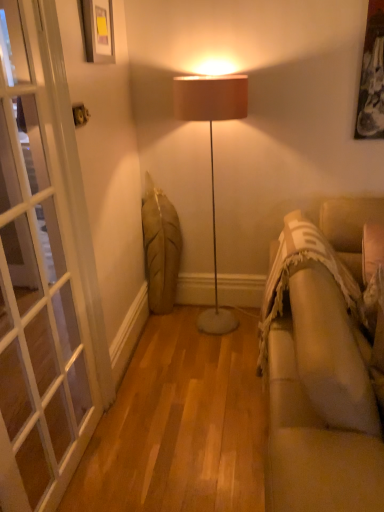
Question: Is white glass screen door at left further to camera compared to beige fabric couch at right?

Choices:
 (A) no
 (B) yes

Answer: (B)

Question: Is white glass screen door at left surrounding beige fabric couch at right?

Choices:
 (A) yes
 (B) no

Answer: (B)

Question: Is white glass screen door at left completely or partially outside of beige fabric couch at right?

Choices:
 (A) no
 (B) yes

Answer: (B)

Question: Can you confirm if white glass screen door at left is bigger than beige fabric couch at right?

Choices:
 (A) yes
 (B) no

Answer: (B)

Question: Is white glass screen door at left wider than beige fabric couch at right?

Choices:
 (A) no
 (B) yes

Answer: (A)

Question: From the image's perspective, is white glass screen door at left over beige fabric couch at right?

Choices:
 (A) yes
 (B) no

Answer: (A)

Question: Is matte black picture frame at upper left completely or partially outside of beige fabric couch at right?

Choices:
 (A) no
 (B) yes

Answer: (B)

Question: Is matte black picture frame at upper left wider than beige fabric couch at right?

Choices:
 (A) yes
 (B) no

Answer: (B)

Question: Does matte black picture frame at upper left contain beige fabric couch at right?

Choices:
 (A) no
 (B) yes

Answer: (A)

Question: Is matte black picture frame at upper left at the right side of beige fabric couch at right?

Choices:
 (A) yes
 (B) no

Answer: (B)

Question: Is the depth of matte black picture frame at upper left greater than that of beige fabric couch at right?

Choices:
 (A) no
 (B) yes

Answer: (B)

Question: Is matte black picture frame at upper left bigger than beige fabric couch at right?

Choices:
 (A) no
 (B) yes

Answer: (A)

Question: Can we say white glass screen door at left lies outside matte black picture frame at upper left?

Choices:
 (A) no
 (B) yes

Answer: (B)